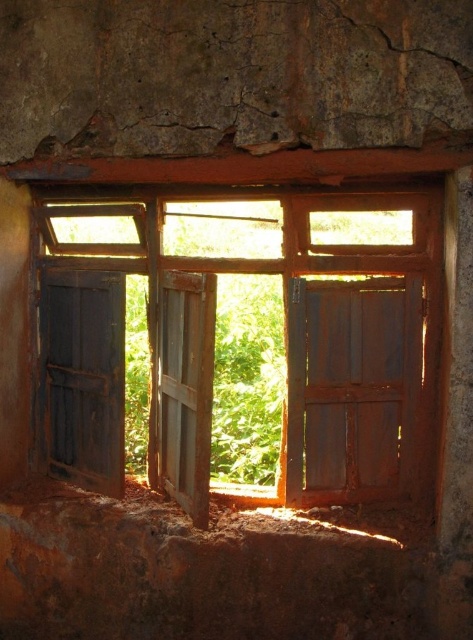
What is the 2D coordinate of the rusty wood window at center in the image?

The 2D coordinate of the rusty wood window at center is at point (250, 340).

You are standing in a room with an open window. You notice two points marked on the wall near the window. One is at coordinates point (146, 310) and the other is at point (180, 376). If you want to touch the point that is closer to you, which one should you choose?

You should choose point (180, 376) because it is closer to you than point (146, 310).